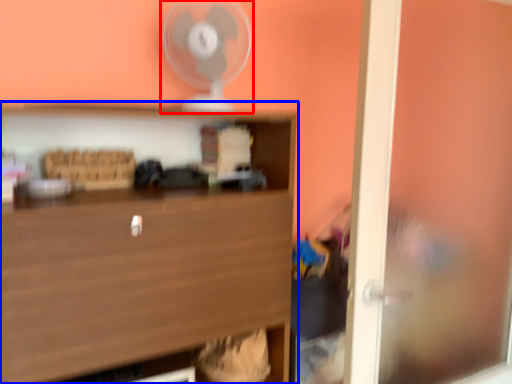
Question: Which object is closer to the camera taking this photo, fan (highlighted by a red box) or shelf (highlighted by a blue box)?

Choices:
 (A) fan
 (B) shelf

Answer: (B)